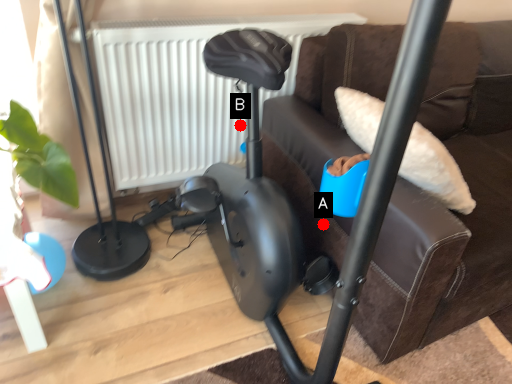
Question: Two points are circled on the image, labeled by A and B beside each circle. Which point appears closest to the camera in this image?

Choices:
 (A) A is closer
 (B) B is closer

Answer: (A)